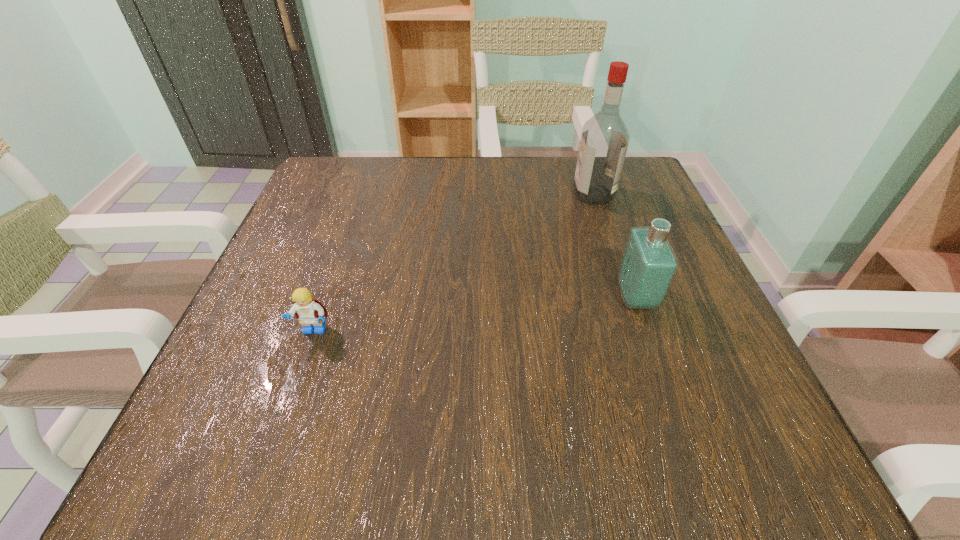
Locate an element on the screen. The image size is (960, 540). empty location between the perfume and the leftmost object is located at coordinates (475, 315).

This screenshot has height=540, width=960. Identify the location of vacant region between the liquor and the Lego. (454, 263).

The image size is (960, 540). Find the location of `empty space between the Lego and the perfume`. empty space between the Lego and the perfume is located at coordinates (475, 315).

Image resolution: width=960 pixels, height=540 pixels. In order to click on object that is the closest to the farthest object in this screenshot , I will do `click(648, 266)`.

Select which object appears as the closest to the liquor. Please provide its 2D coordinates. Your answer should be formatted as a tuple, i.e. [(x, y)], where the tuple contains the x and y coordinates of a point satisfying the conditions above.

[(648, 266)]

Locate an element on the screen. This screenshot has width=960, height=540. vacant point that satisfies the following two spatial constraints: 1. on the front label of the perfume; 2. on the front-facing side of the leftmost object is located at coordinates (647, 331).

Find the location of a particular element. The image size is (960, 540). vacant area that satisfies the following two spatial constraints: 1. on the front-facing side of the liquor; 2. on the front-facing side of the Lego is located at coordinates (638, 331).

Where is `vacant point that satisfies the following two spatial constraints: 1. on the front label of the second tallest object; 2. on the front-facing side of the Lego`? The width and height of the screenshot is (960, 540). vacant point that satisfies the following two spatial constraints: 1. on the front label of the second tallest object; 2. on the front-facing side of the Lego is located at coordinates (647, 331).